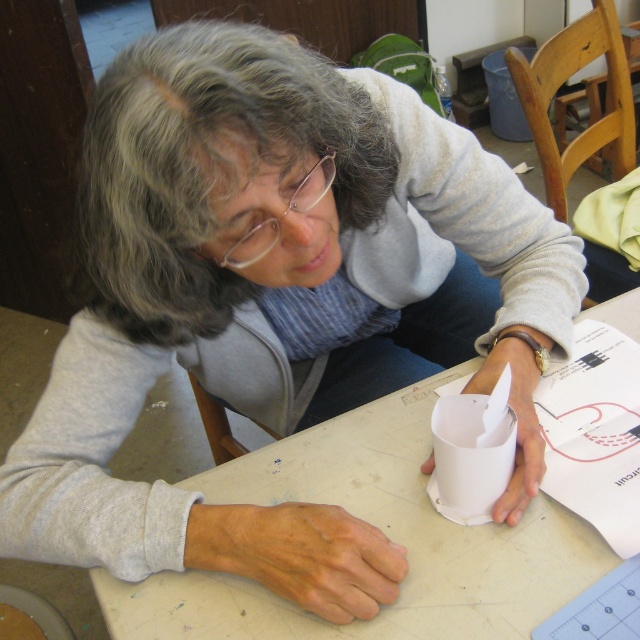
You are a photographer trying to capture the person crafting. The gray matte hair at upper center and the white paper at lower right are both in the frame. Which object will appear larger in the photo?

The gray matte hair at upper center will appear larger in the photo because it is much taller than the white paper at lower right.

You are a photographer taking a closeup shot of the person in the image. The camera is focused on the point at (209, 166). What part of the person is in focus?

The gray matte hair at upper center is located at point (209, 166), so the camera is focused on the gray matte hair at upper center.